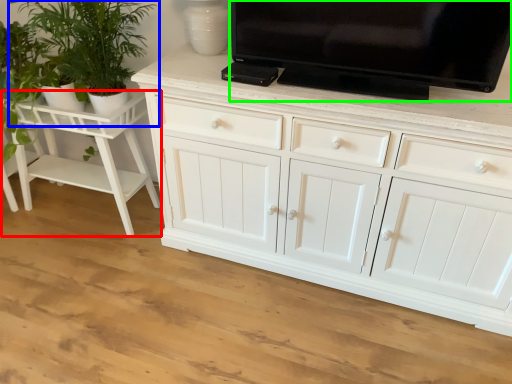
Question: Considering the real-world distances, which object is farthest from vanity (highlighted by a red box)? houseplant (highlighted by a blue box) or television (highlighted by a green box)?

Choices:
 (A) houseplant
 (B) television

Answer: (B)